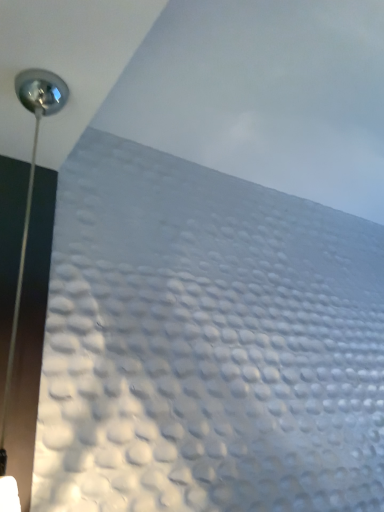
Question: Should I look upward or downward to see satin silver lamp at upper left?

Choices:
 (A) down
 (B) up

Answer: (A)